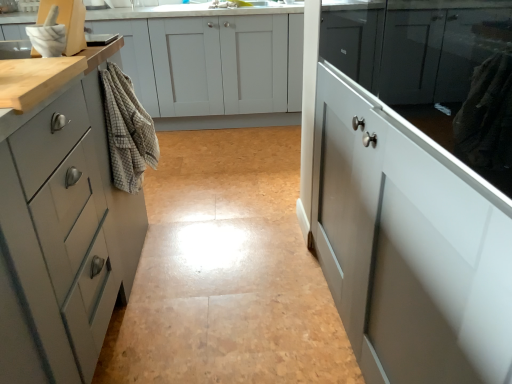
What is the approximate height of matte white cabinet at right, marked as the 2th cabinetry in a front-to-back arrangement?

The height of matte white cabinet at right, marked as the 2th cabinetry in a front-to-back arrangement, is 3.49 feet.

Measure the distance between point (497,67) and camera.

A distance of 22.20 inches exists between point (497,67) and camera.

Describe the element at coordinates (69, 220) in the screenshot. I see `matte gray cabinet at left, acting as the third cabinetry starting from the front` at that location.

Locate an element on the screen. This screenshot has width=512, height=384. brushed metal faucet at upper center, which appears as the second faucet when viewed from the right is located at coordinates (132, 5).

Considering the sizes of matte gray cabinet at left, acting as the second cabinetry starting from the back, and beige checkered towel at left in the image, is matte gray cabinet at left, acting as the second cabinetry starting from the back, bigger or smaller than beige checkered towel at left?

Clearly, matte gray cabinet at left, acting as the second cabinetry starting from the back, is larger in size than beige checkered towel at left.

Is beige checkered towel at left at the back of matte gray cabinet at left, acting as the second cabinetry starting from the back?

That's not correct — matte gray cabinet at left, acting as the second cabinetry starting from the back, is not looking away from beige checkered towel at left.

Is matte gray cabinet at left, acting as the second cabinetry starting from the back, further to the viewer compared to beige checkered towel at left?

No, it is not.

Where is `the 1st cabinetry in front when counting from the beige checkered towel at left`? This screenshot has width=512, height=384. the 1st cabinetry in front when counting from the beige checkered towel at left is located at coordinates (69, 220).

Do you think matte white cabinets at center, which ranks as the fourth cabinetry in front-to-back order, is within brushed metal faucet at upper center, which appears as the second faucet when viewed from the right, or outside of it?

matte white cabinets at center, which ranks as the fourth cabinetry in front-to-back order, is spatially situated outside brushed metal faucet at upper center, which appears as the second faucet when viewed from the right.

From the image's perspective, would you say matte white cabinets at center, the first cabinetry from the back, is shown under brushed metal faucet at upper center, which appears as the first faucet when viewed from the back?

Yes, from the image's perspective, matte white cabinets at center, the first cabinetry from the back, is below brushed metal faucet at upper center, which appears as the first faucet when viewed from the back.

The width and height of the screenshot is (512, 384). Identify the location of the 1st faucet above the matte white cabinets at center, which ranks as the fourth cabinetry in front-to-back order (from a real-world perspective). (132, 5).

Does matte white cabinets at center, which ranks as the fourth cabinetry in front-to-back order, have a lesser height compared to brushed metal faucet at upper center, the second faucet positioned from the front?

No, matte white cabinets at center, which ranks as the fourth cabinetry in front-to-back order, is not shorter than brushed metal faucet at upper center, the second faucet positioned from the front.

From the image's perspective, is matte white cabinet at right, which is counted as the 3th cabinetry, starting from the back, below beige checkered towel at left?

Correct, matte white cabinet at right, which is counted as the 3th cabinetry, starting from the back, appears lower than beige checkered towel at left in the image.

Would you say matte white cabinet at right, which is counted as the 3th cabinetry, starting from the back, is outside beige checkered towel at left?

Indeed, matte white cabinet at right, which is counted as the 3th cabinetry, starting from the back, is completely outside beige checkered towel at left.

Considering the positions of objects matte white cabinet at right, marked as the 2th cabinetry in a front-to-back arrangement, and beige checkered towel at left in the image provided, who is more to the right, matte white cabinet at right, marked as the 2th cabinetry in a front-to-back arrangement, or beige checkered towel at left?

From the viewer's perspective, matte white cabinet at right, marked as the 2th cabinetry in a front-to-back arrangement, appears more on the right side.

Relative to beige checkered towel at left, is matte white cabinet at right, which is counted as the 3th cabinetry, starting from the back, in front or behind?

Clearly, matte white cabinet at right, which is counted as the 3th cabinetry, starting from the back, is in front of beige checkered towel at left.

Could you tell me if brushed metal faucet at upper center, which is the 2th faucet in back-to-front order, is turned towards matte gray cabinet at left, acting as the third cabinetry starting from the front?

No, brushed metal faucet at upper center, which is the 2th faucet in back-to-front order, is not facing towards matte gray cabinet at left, acting as the third cabinetry starting from the front.

Looking at this image, is brushed metal faucet at upper center, which is the 2th faucet in back-to-front order, beside matte gray cabinet at left, acting as the second cabinetry starting from the back?

Result: brushed metal faucet at upper center, which is the 2th faucet in back-to-front order, and matte gray cabinet at left, acting as the second cabinetry starting from the back, are clearly separated.

Considering the relative sizes of brushed metal faucet at upper center, marked as the first faucet in a right-to-left arrangement, and matte gray cabinet at left, acting as the second cabinetry starting from the back, in the image provided, is brushed metal faucet at upper center, marked as the first faucet in a right-to-left arrangement, taller than matte gray cabinet at left, acting as the second cabinetry starting from the back,?

No.

From the image's perspective, would you say brushed metal faucet at upper center, marked as the first faucet in a right-to-left arrangement, is positioned over matte gray cabinet at left, acting as the third cabinetry starting from the front?

Correct, brushed metal faucet at upper center, marked as the first faucet in a right-to-left arrangement, appears higher than matte gray cabinet at left, acting as the third cabinetry starting from the front, in the image.

Considering the relative sizes of beige checkered towel at left and matte gray cabinet at left, acting as the second cabinetry starting from the back, in the image provided, is beige checkered towel at left smaller than matte gray cabinet at left, acting as the second cabinetry starting from the back,?

Correct, beige checkered towel at left occupies less space than matte gray cabinet at left, acting as the second cabinetry starting from the back.

Measure the distance between beige checkered towel at left and matte gray cabinet at left, acting as the third cabinetry starting from the front.

beige checkered towel at left and matte gray cabinet at left, acting as the third cabinetry starting from the front, are 29.45 centimeters apart.

Is beige checkered towel at left spatially inside matte gray cabinet at left, acting as the second cabinetry starting from the back, or outside of it?

beige checkered towel at left lies outside matte gray cabinet at left, acting as the second cabinetry starting from the back.

Does beige checkered towel at left come behind matte gray cabinet at left, acting as the second cabinetry starting from the back?

Yes.

Is matte gray cabinet at left, acting as the third cabinetry starting from the front, oriented towards brushed metal faucet at upper center, which appears as the first faucet when viewed from the back?

Yes, matte gray cabinet at left, acting as the third cabinetry starting from the front, is turned towards brushed metal faucet at upper center, which appears as the first faucet when viewed from the back.

In the scene shown: Can you confirm if matte gray cabinet at left, acting as the second cabinetry starting from the back, is thinner than brushed metal faucet at upper center, which is the first faucet in left-to-right order?

→ No, matte gray cabinet at left, acting as the second cabinetry starting from the back, is not thinner than brushed metal faucet at upper center, which is the first faucet in left-to-right order.

Choose the correct answer: Is matte gray cabinet at left, acting as the third cabinetry starting from the front, inside brushed metal faucet at upper center, which appears as the second faucet when viewed from the right, or outside it?

matte gray cabinet at left, acting as the third cabinetry starting from the front, is spatially situated outside brushed metal faucet at upper center, which appears as the second faucet when viewed from the right.

Is matte gray cabinet at left, acting as the third cabinetry starting from the front, smaller than brushed metal faucet at upper center, which appears as the second faucet when viewed from the right?

No.

From the image's perspective, is matte white cabinets at center, which ranks as the fourth cabinetry in front-to-back order, over white glossy cabinet at right, the first cabinetry positioned from the front?

Yes, from the image's perspective, matte white cabinets at center, which ranks as the fourth cabinetry in front-to-back order, is on top of white glossy cabinet at right, the first cabinetry positioned from the front.

Is matte white cabinets at center, the first cabinetry from the back, far from white glossy cabinet at right, placed as the fourth cabinetry when sorted from back to front?

That's right, there is a large distance between matte white cabinets at center, the first cabinetry from the back, and white glossy cabinet at right, placed as the fourth cabinetry when sorted from back to front.

Considering the sizes of objects matte white cabinets at center, the first cabinetry from the back, and white glossy cabinet at right, the first cabinetry positioned from the front, in the image provided, who is smaller, matte white cabinets at center, the first cabinetry from the back, or white glossy cabinet at right, the first cabinetry positioned from the front,?

Smaller between the two is white glossy cabinet at right, the first cabinetry positioned from the front.

Relative to white glossy cabinet at right, the first cabinetry positioned from the front, is matte white cabinets at center, the first cabinetry from the back, in front or behind?

Visually, matte white cabinets at center, the first cabinetry from the back, is located behind white glossy cabinet at right, the first cabinetry positioned from the front.

Find the location of `material above the matte gray cabinet at left, acting as the third cabinetry starting from the front (from the image's perspective)`. material above the matte gray cabinet at left, acting as the third cabinetry starting from the front (from the image's perspective) is located at coordinates (127, 131).

From the image's perspective, count 1st cabinetrys downward from the brushed metal faucet at upper center, the second faucet positioned from the front, and point to it. Please provide its 2D coordinates.

[(212, 64)]

Looking at the image, which one is located closer to matte white cabinets at center, the first cabinetry from the back, white glossy cabinet at right, placed as the fourth cabinetry when sorted from back to front, or matte gray cabinet at left, acting as the second cabinetry starting from the back?

matte gray cabinet at left, acting as the second cabinetry starting from the back, is closer to matte white cabinets at center, the first cabinetry from the back.

Considering their positions, is matte gray cabinet at left, acting as the second cabinetry starting from the back, positioned closer to brushed metal faucet at upper center, which is the 2th faucet in back-to-front order, than white glossy cabinet at right, the first cabinetry positioned from the front?

matte gray cabinet at left, acting as the second cabinetry starting from the back.

Consider the image. Looking at the image, which one is located further to brushed metal faucet at upper center, the first faucet from the front, white glossy cabinet at right, the first cabinetry positioned from the front, or matte gray cabinet at left, acting as the second cabinetry starting from the back?

Based on the image, white glossy cabinet at right, the first cabinetry positioned from the front, appears to be further to brushed metal faucet at upper center, the first faucet from the front.

Based on the photo, looking at the image, which one is located closer to matte gray cabinet at left, acting as the second cabinetry starting from the back, beige checkered towel at left or matte white cabinets at center, which ranks as the fourth cabinetry in front-to-back order?

Among the two, beige checkered towel at left is located nearer to matte gray cabinet at left, acting as the second cabinetry starting from the back.

Considering their positions, is matte white cabinets at center, the first cabinetry from the back, positioned further to beige checkered towel at left than white glossy cabinet at right, the first cabinetry positioned from the front?

matte white cabinets at center, the first cabinetry from the back, lies further to beige checkered towel at left than the other object.

Estimate the real-world distances between objects in this image. Which object is closer to matte white cabinet at right, marked as the 2th cabinetry in a front-to-back arrangement, white glossy cabinet at right, placed as the fourth cabinetry when sorted from back to front, or beige checkered towel at left?

white glossy cabinet at right, placed as the fourth cabinetry when sorted from back to front, is closer to matte white cabinet at right, marked as the 2th cabinetry in a front-to-back arrangement.

Looking at the image, which one is located closer to matte white cabinets at center, the first cabinetry from the back, beige checkered towel at left or matte gray cabinet at left, acting as the third cabinetry starting from the front?

Based on the image, beige checkered towel at left appears to be nearer to matte white cabinets at center, the first cabinetry from the back.

From the image, which object appears to be farther from matte white cabinets at center, the first cabinetry from the back, beige checkered towel at left or matte white cabinet at right, which is counted as the 3th cabinetry, starting from the back?

matte white cabinet at right, which is counted as the 3th cabinetry, starting from the back, is positioned further to the anchor matte white cabinets at center, the first cabinetry from the back.

The height and width of the screenshot is (384, 512). In order to click on material positioned between matte gray cabinet at left, acting as the second cabinetry starting from the back, and brushed metal faucet at upper center, which is the first faucet in left-to-right order, from near to far in this screenshot , I will do `click(127, 131)`.

Where is `faucet located between matte white cabinet at right, marked as the 2th cabinetry in a front-to-back arrangement, and brushed metal faucet at upper center, which appears as the second faucet when viewed from the right, in the depth direction`? This screenshot has width=512, height=384. faucet located between matte white cabinet at right, marked as the 2th cabinetry in a front-to-back arrangement, and brushed metal faucet at upper center, which appears as the second faucet when viewed from the right, in the depth direction is located at coordinates (281, 2).

Find the location of a particular element. faucet located between matte gray cabinet at left, acting as the second cabinetry starting from the back, and brushed metal faucet at upper center, which appears as the second faucet when viewed from the right, in the depth direction is located at coordinates (281, 2).

This screenshot has height=384, width=512. Identify the location of material located between white glossy cabinet at right, placed as the fourth cabinetry when sorted from back to front, and matte white cabinets at center, which ranks as the fourth cabinetry in front-to-back order, in the depth direction. (127, 131).